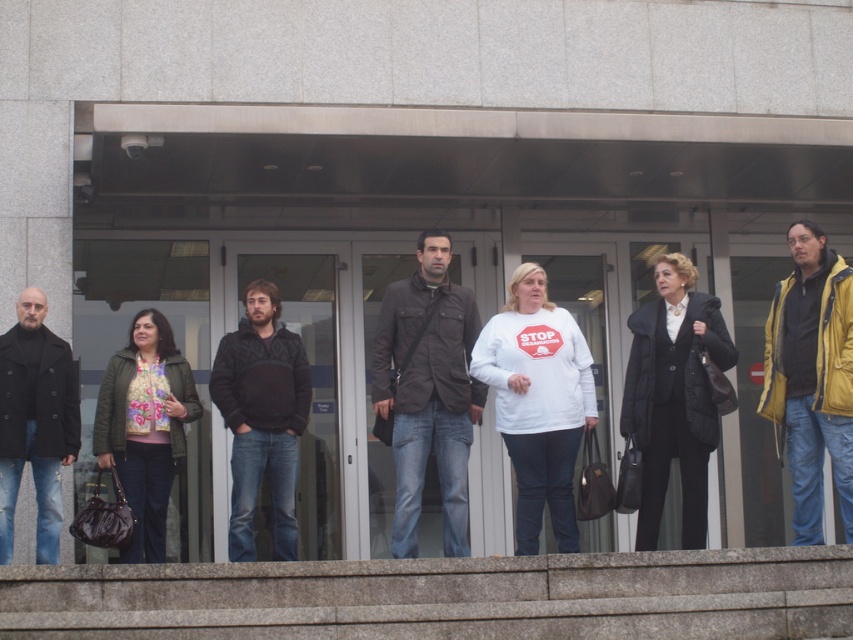
Is yellow matte jacket at right positioned at the back of floral-patterned fabric top at center?

No, it is not.

Between point (782, 291) and point (186, 417), which one is positioned behind?

Point (186, 417)

Locate an element on the screen. yellow matte jacket at right is located at coordinates (811, 376).

Is point (397, 305) more distant than point (234, 516)?

Yes, it is.

Does matte brown jacket at center have a greater width compared to black fleece at center?

Yes.

You are a GUI agent. You are given a task and a screenshot of the screen. Output one action in this format:
    pyautogui.click(x=<x>, y=<y>)
    Task: Click on the matte brown jacket at center
    This screenshot has height=640, width=853.
    Given the screenshot: What is the action you would take?
    427,392

Between point (421, 404) and point (9, 376), which one is positioned in front?

Point (9, 376) is in front.

Between matte brown jacket at center and black wool coat at left, which one has less height?

With less height is black wool coat at left.

Is point (405, 384) behind point (51, 365)?

That is True.

Identify the location of matte brown jacket at center. The height and width of the screenshot is (640, 853). (427, 392).